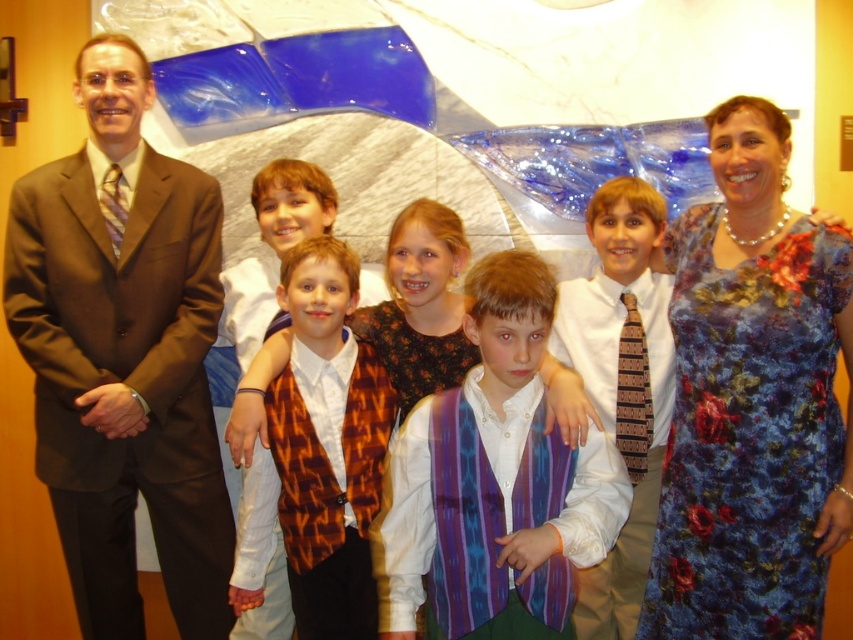
You are a photographer setting up for a family photo. You want to ensure that the floral silk dress at right and the orange patterned vest at center are in focus simultaneously. Given that your camera has a depth of field range of 30 inches, will both objects be in focus?

The distance between the floral silk dress at right and the orange patterned vest at center is 33.25 inches. Since this exceeds the camera depth of field range of 30 inches, both objects cannot be in focus simultaneously.

Based on the scene description, where is the brown suit at left positioned in the image?

The brown suit at left is positioned at the coordinates point [123,356] in the image.